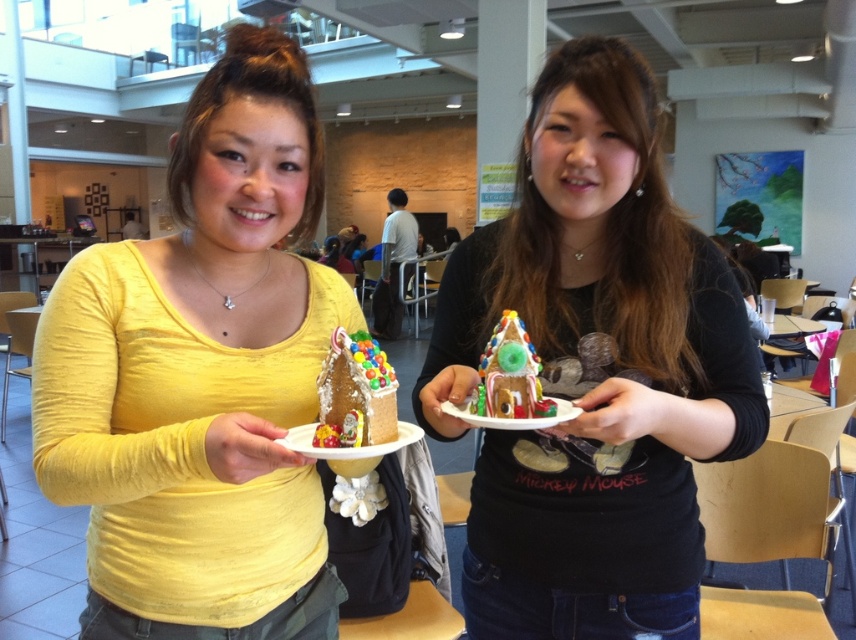
You are a photographer setting up a shot of the yellow matte shirt at center and the glossy gingerbread house at center. Which object should you focus on first if you want to capture both in the same frame without adjusting your camera settings?

The yellow matte shirt at center is taller than the glossy gingerbread house at center, so you should focus on the yellow matte shirt at center first to ensure proper framing and depth of field.

You are a delivery robot with a height of 36 inches. You need to navigate through the space to deliver a package. Is there enough clearance for you to pass under the point at coordinate (187,548) without hitting your head?

The distance of point (187,548) from camera is 36.62 inches. Since the robot is 36 inches tall, there is 0.62 inches of clearance, so it can pass under the point at coordinate (187,548) but must be cautious due to the minimal space.

You are a photographer trying to capture the glossy gingerbread house at center without including the yellow matte shirt at center in the frame. Is this possible given their current positions?

The yellow matte shirt at center is positioned over the glossy gingerbread house at center, so it would block the view. Therefore, it is not possible to capture the glossy gingerbread house at center without including the yellow matte shirt at center in the frame.